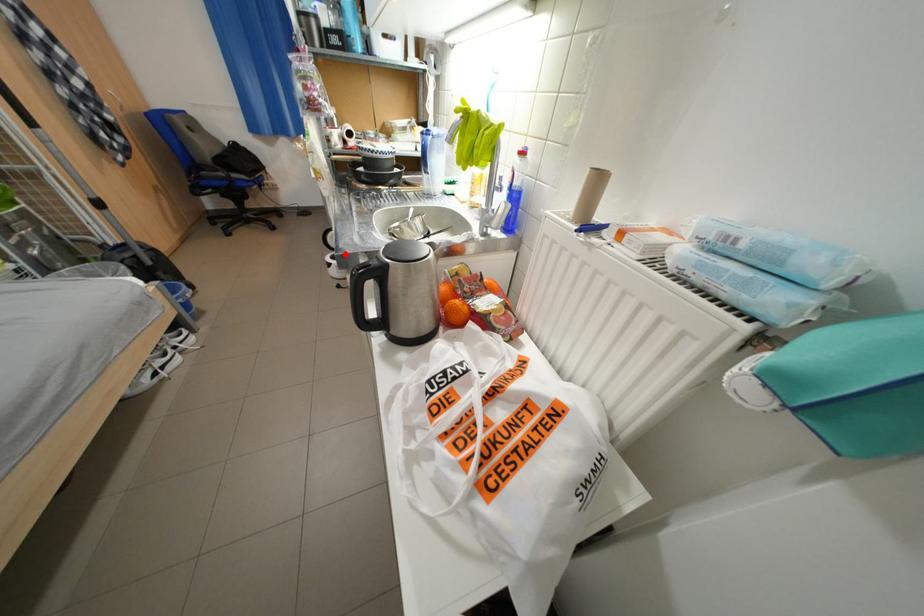
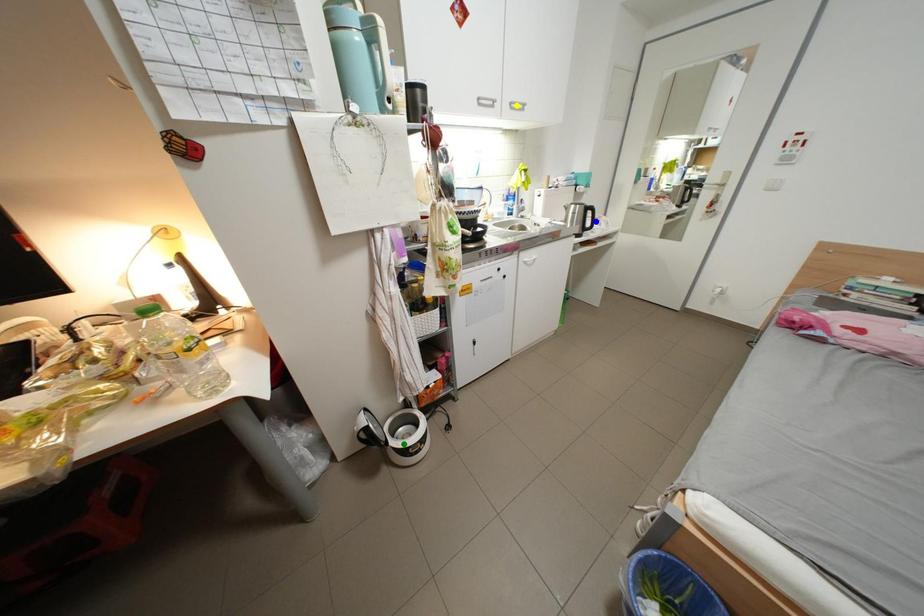
Question: I am providing you with two images of the same scene from different viewpoints. A red point is marked on the first image. You are given multiple points on the second image. Can you choose the point in image 2 that corresponds to the point in image 1?

Choices:
 (A) green point
 (B) yellow point
 (C) blue point

Answer: (A)